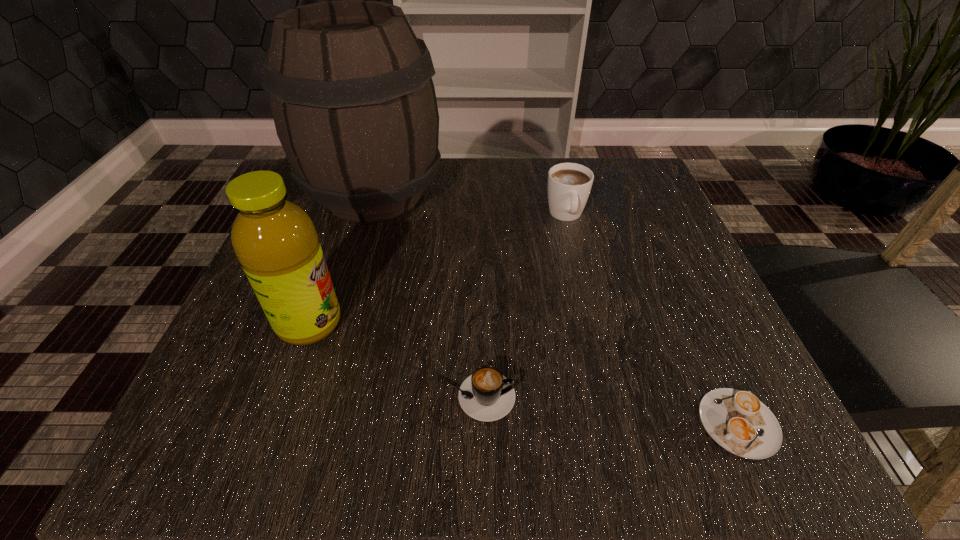
At what (x,y) coordinates should I click in order to perform the action: click on free space in the image that satisfies the following two spatial constraints: 1. with the handle on the side of the third shortest object; 2. with the handle on the side of the third object from right to left. Please return your answer as a coordinate pair (x, y). Looking at the image, I should click on (609, 397).

At what (x,y) coordinates should I click in order to perform the action: click on free space that satisfies the following two spatial constraints: 1. with the handle on the side of the farthest cappuccino; 2. with the handle on the side of the second shortest object. Please return your answer as a coordinate pair (x, y). Looking at the image, I should click on (609, 397).

At what (x,y) coordinates should I click in order to perform the action: click on free space that satisfies the following two spatial constraints: 1. with the handle on the side of the second tallest cappuccino; 2. on the left side of the shortest object. Please return your answer as a coordinate pair (x, y). Looking at the image, I should click on (476, 423).

Find the location of a particular element. vacant area in the image that satisfies the following two spatial constraints: 1. with the handle on the side of the tallest cappuccino; 2. with the handle on the side of the third object from left to right is located at coordinates (609, 397).

Find the location of a particular element. The width and height of the screenshot is (960, 540). vacant point that satisfies the following two spatial constraints: 1. with the handle on the side of the second shortest object; 2. on the left side of the rightmost object is located at coordinates (476, 423).

Image resolution: width=960 pixels, height=540 pixels. I want to click on free location that satisfies the following two spatial constraints: 1. on the front label of the rightmost object; 2. on the right side of the third farthest object, so click(x=274, y=423).